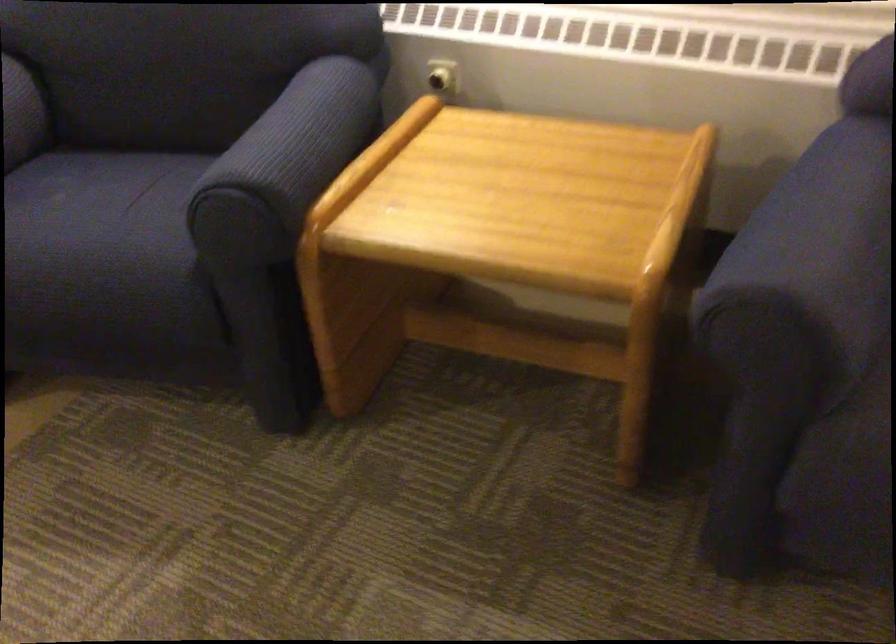
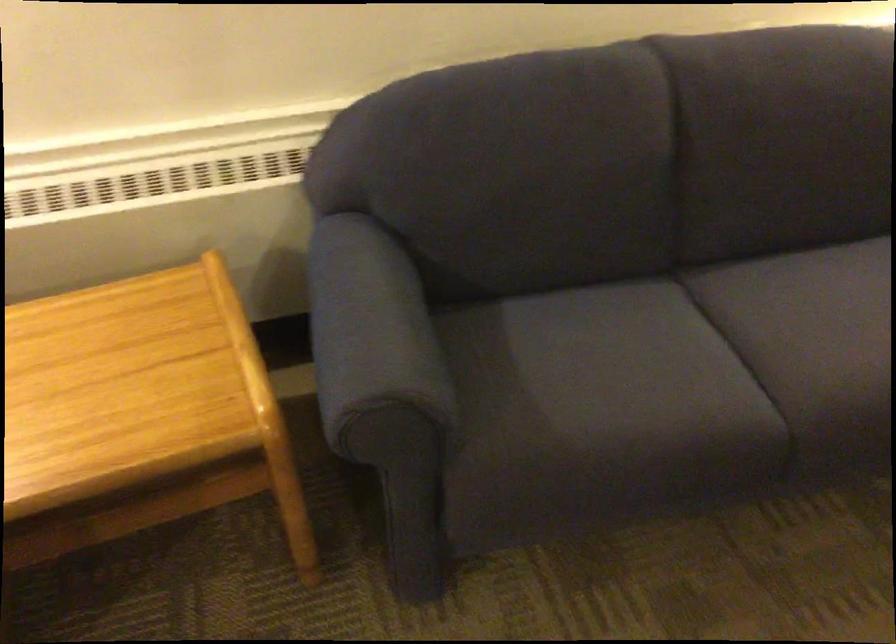
Question: The first image is from the beginning of the video and the second image is from the end. How did the camera likely rotate when shooting the video?

Choices:
 (A) Left
 (B) Right
 (C) Up
 (D) Down

Answer: (B)